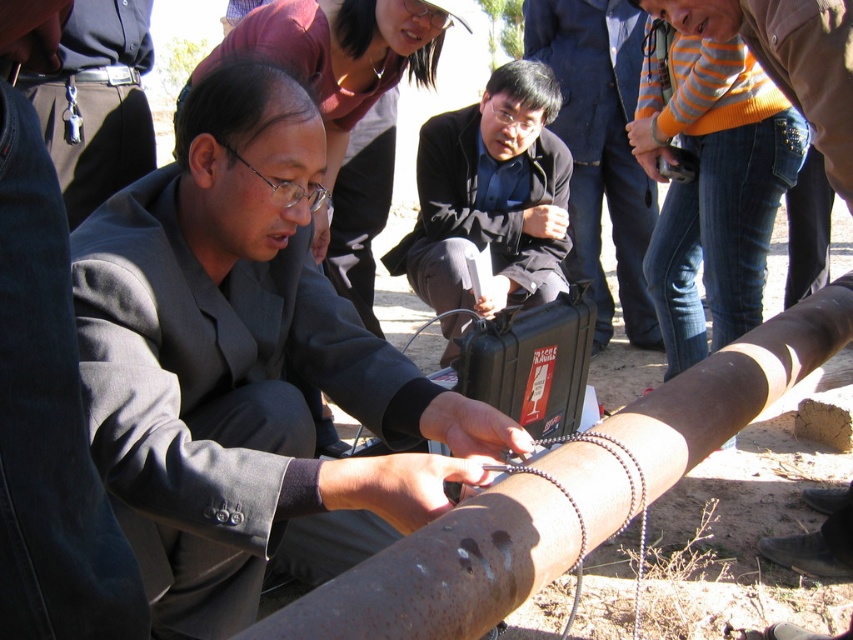
Question: Which object is closer to the camera taking this photo?

Choices:
 (A) black matte briefcase at center
 (B) rusty metal pipe at center
 (C) matte black suit at center

Answer: (B)

Question: Is matte gray suit at center below rusty metal pipe at center?

Choices:
 (A) yes
 (B) no

Answer: (B)

Question: Which object appears farthest from the camera in this image?

Choices:
 (A) black matte briefcase at center
 (B) rusty metal pipe at center
 (C) matte black briefcase at center

Answer: (C)

Question: Is matte gray suit at center positioned before matte black briefcase at center?

Choices:
 (A) yes
 (B) no

Answer: (A)

Question: Does black matte briefcase at center come in front of matte black suit at center?

Choices:
 (A) no
 (B) yes

Answer: (A)

Question: Based on their relative distances, which object is nearer to the matte gray suit at center?

Choices:
 (A) matte black suit at center
 (B) black matte briefcase at center

Answer: (A)